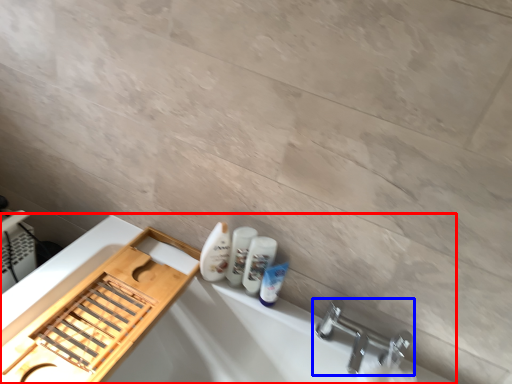
Question: Among these objects, which one is farthest to the camera, bath (highlighted by a red box) or tap (highlighted by a blue box)?

Choices:
 (A) bath
 (B) tap

Answer: (B)